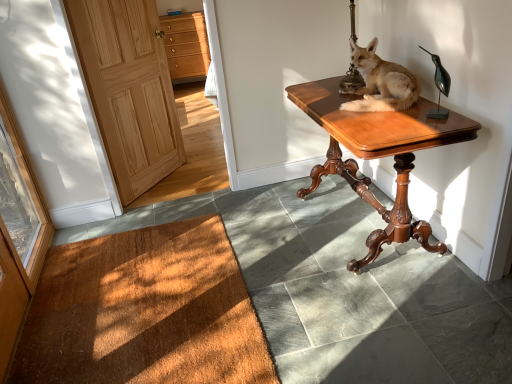
In the scene shown: Measure the distance between point (366,141) and camera.

They are 5.37 feet apart.

What are the coordinates of `light brown wood drawers at upper left` in the screenshot? It's located at (186, 45).

What do you see at coordinates (144, 312) in the screenshot? I see `brown textured mat at lower left` at bounding box center [144, 312].

What do you see at coordinates (439, 87) in the screenshot? Image resolution: width=512 pixels, height=384 pixels. I see `bronze metallic bird at upper right` at bounding box center [439, 87].

Describe the element at coordinates (16, 201) in the screenshot. The width and height of the screenshot is (512, 384). I see `transparent glass door at left` at that location.

Where is `mahogany wood desk at center`? mahogany wood desk at center is located at coordinates (378, 155).

Can you confirm if transparent glass door at left is wider than light brown wood drawers at upper left?

In fact, transparent glass door at left might be narrower than light brown wood drawers at upper left.

From the picture: Is transparent glass door at left aimed at light brown wood drawers at upper left?

No, transparent glass door at left does not turn towards light brown wood drawers at upper left.

From a real-world perspective, is transparent glass door at left on light brown wood drawers at upper left?

Indeed, from a real-world perspective, transparent glass door at left stands above light brown wood drawers at upper left.

Can light brown wood drawers at upper left be found inside transparent glass door at left?

No, light brown wood drawers at upper left is not inside transparent glass door at left.

Which of these two, brown textured mat at lower left or light brown wood drawers at upper left, stands taller?

light brown wood drawers at upper left is taller.

From the image's perspective, is brown textured mat at lower left under light brown wood drawers at upper left?

Correct, brown textured mat at lower left appears lower than light brown wood drawers at upper left in the image.

From a real-world perspective, who is located higher, brown textured mat at lower left or light brown wood drawers at upper left?

light brown wood drawers at upper left.

What are the coordinates of `doormat below the light brown wood drawers at upper left (from the image's perspective)` in the screenshot? It's located at [x=144, y=312].

Could you tell me if brown textured mat at lower left is facing light brown fur at center?

No, brown textured mat at lower left is not turned towards light brown fur at center.

Looking at their sizes, would you say brown textured mat at lower left is wider or thinner than light brown fur at center?

In the image, brown textured mat at lower left appears to be wider than light brown fur at center.

Where is `doormat below the light brown fur at center (from a real-world perspective)`? The height and width of the screenshot is (384, 512). doormat below the light brown fur at center (from a real-world perspective) is located at coordinates (144, 312).

Considering the relative sizes of brown textured mat at lower left and light brown fur at center in the image provided, is brown textured mat at lower left bigger than light brown fur at center?

No.

Is light brown fur at center looking in the opposite direction of transparent glass door at left?

No, light brown fur at center is not facing the opposite direction of transparent glass door at left.

Considering the relative sizes of light brown fur at center and transparent glass door at left in the image provided, is light brown fur at center taller than transparent glass door at left?

Incorrect, the height of light brown fur at center is not larger of that of transparent glass door at left.

Are light brown fur at center and transparent glass door at left beside each other?

light brown fur at center is not next to transparent glass door at left, and they're not touching.

From the picture: Considering the relative positions of light brown wood door at left and bronze metallic bird at upper right in the image provided, is light brown wood door at left to the left or to the right of bronze metallic bird at upper right?

From the image, it's evident that light brown wood door at left is to the left of bronze metallic bird at upper right.

From the image's perspective, is light brown wood door at left located beneath bronze metallic bird at upper right?

No.

Considering the sizes of objects light brown wood door at left and bronze metallic bird at upper right in the image provided, who is shorter, light brown wood door at left or bronze metallic bird at upper right?

Standing shorter between the two is bronze metallic bird at upper right.

How different are the orientations of light brown wood door at left and bronze metallic bird at upper right in degrees?

147 degrees.

Would you say light brown fur at center contains bronze metallic bird at upper right?

No, bronze metallic bird at upper right is not inside light brown fur at center.

Is light brown fur at center wider than bronze metallic bird at upper right?

Yes.

In order to click on table lamp lying in front of the light brown fur at center in this screenshot , I will do `click(439, 87)`.

Does light brown wood door at left have a lesser width compared to brown textured mat at lower left?

Indeed, light brown wood door at left has a lesser width compared to brown textured mat at lower left.

Could you tell me if light brown wood door at left is facing brown textured mat at lower left?

No, light brown wood door at left does not turn towards brown textured mat at lower left.

Is light brown wood door at left taller than brown textured mat at lower left?

Correct, light brown wood door at left is much taller as brown textured mat at lower left.

You are a GUI agent. You are given a task and a screenshot of the screen. Output one action in this format:
    pyautogui.click(x=<x>, y=<y>)
    Task: Click on the glass door that is below the light brown wood drawers at upper left (from the image's perspective)
    The width and height of the screenshot is (512, 384).
    Given the screenshot: What is the action you would take?
    pyautogui.click(x=16, y=201)

Locate an element on the screen. The width and height of the screenshot is (512, 384). cabinetry that appears behind the brown textured mat at lower left is located at coordinates (186, 45).

When comparing their distances from bronze metallic bird at upper right, does light brown fur at center or light brown wood drawers at upper left seem further?

Based on the image, light brown wood drawers at upper left appears to be further to bronze metallic bird at upper right.

Looking at the image, which one is located further to light brown fur at center, transparent glass door at left or light brown wood drawers at upper left?

Among the two, light brown wood drawers at upper left is located further to light brown fur at center.

Considering their positions, is light brown wood drawers at upper left positioned further to mahogany wood desk at center than bronze metallic bird at upper right?

Based on the image, light brown wood drawers at upper left appears to be further to mahogany wood desk at center.

When comparing their distances from transparent glass door at left, does light brown wood drawers at upper left or mahogany wood desk at center seem further?

light brown wood drawers at upper left lies further to transparent glass door at left than the other object.

Estimate the real-world distances between objects in this image. Which object is closer to transparent glass door at left, light brown wood drawers at upper left or bronze metallic bird at upper right?

bronze metallic bird at upper right is positioned closer to the anchor transparent glass door at left.

From the image, which object appears to be nearer to mahogany wood desk at center, transparent glass door at left or light brown wood door at left?

light brown wood door at left is closer to mahogany wood desk at center.

Estimate the real-world distances between objects in this image. Which object is further from light brown fur at center, light brown wood drawers at upper left or light brown wood door at left?

light brown wood drawers at upper left.

Considering their positions, is mahogany wood desk at center positioned further to brown textured mat at lower left than light brown fur at center?

Based on the image, light brown fur at center appears to be further to brown textured mat at lower left.

The height and width of the screenshot is (384, 512). Identify the location of dog positioned between bronze metallic bird at upper right and light brown wood drawers at upper left from near to far. (381, 82).

Find the location of a particular element. The height and width of the screenshot is (384, 512). doormat between transparent glass door at left and bronze metallic bird at upper right in the horizontal direction is located at coordinates (144, 312).

Find the location of `door between brown textured mat at lower left and light brown wood drawers at upper left from front to back`. door between brown textured mat at lower left and light brown wood drawers at upper left from front to back is located at coordinates (129, 89).

This screenshot has height=384, width=512. Identify the location of glass door between bronze metallic bird at upper right and light brown wood drawers at upper left along the z-axis. (16, 201).